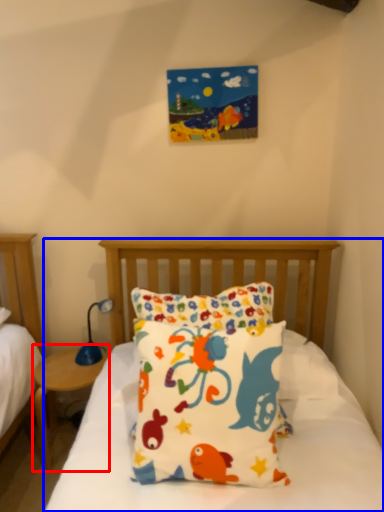
Question: Which object appears farthest to the camera in this image, nightstand (highlighted by a red box) or bed (highlighted by a blue box)?

Choices:
 (A) nightstand
 (B) bed

Answer: (A)